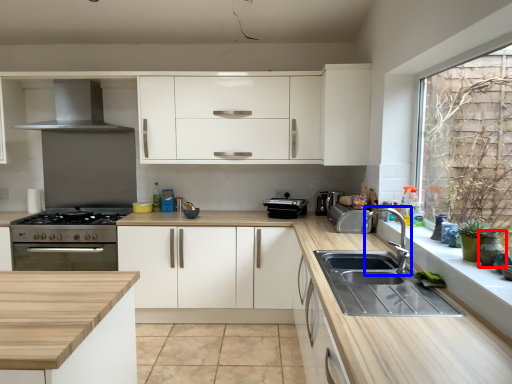
Question: Which of the following is the closest to the observer, appliance (highlighted by a red box) or tap (highlighted by a blue box)?

Choices:
 (A) appliance
 (B) tap

Answer: (A)